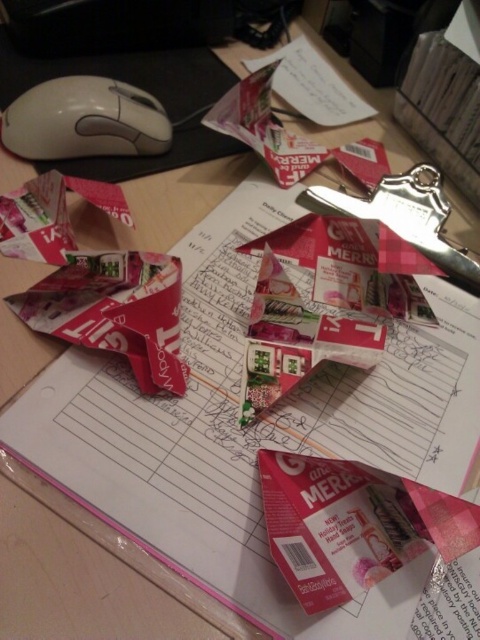
Question: Can you confirm if matte gray mouse at upper left is bigger than metallic silver scissors at center-right?

Choices:
 (A) yes
 (B) no

Answer: (B)

Question: Can you confirm if matte gray mouse at upper left is positioned to the right of metallic silver scissors at center-right?

Choices:
 (A) no
 (B) yes

Answer: (A)

Question: Estimate the real-world distances between objects in this image. Which object is farther from the metallic silver scissors at center-right?

Choices:
 (A) white paper at upper center
 (B) matte gray mouse at upper left

Answer: (B)

Question: Which point is farther from the camera taking this photo?

Choices:
 (A) (372, 193)
 (B) (163, 109)
 (C) (313, 88)

Answer: (C)

Question: Which object appears farthest from the camera in this image?

Choices:
 (A) metallic silver scissors at center-right
 (B) matte gray mouse at upper left
 (C) white paper at upper center

Answer: (C)

Question: Is metallic silver scissors at center-right further to the viewer compared to white paper at upper center?

Choices:
 (A) no
 (B) yes

Answer: (A)